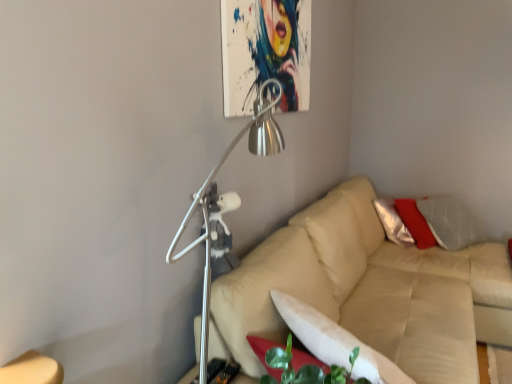
Question: Is metallic silver lamp at upper center positioned beyond the bounds of white soft pillow at lower center?

Choices:
 (A) yes
 (B) no

Answer: (A)

Question: Does metallic silver lamp at upper center have a smaller size compared to white soft pillow at lower center?

Choices:
 (A) yes
 (B) no

Answer: (B)

Question: Does metallic silver lamp at upper center appear on the right side of white soft pillow at lower center?

Choices:
 (A) yes
 (B) no

Answer: (B)

Question: From the image's perspective, is metallic silver lamp at upper center on top of white soft pillow at lower center?

Choices:
 (A) yes
 (B) no

Answer: (A)

Question: Is the position of metallic silver lamp at upper center more distant than that of white soft pillow at lower center?

Choices:
 (A) no
 (B) yes

Answer: (A)

Question: Do you think metallic silver lamp at upper center is within beige leather couch at center, or outside of it?

Choices:
 (A) outside
 (B) inside

Answer: (A)

Question: Relative to beige leather couch at center, is metallic silver lamp at upper center in front or behind?

Choices:
 (A) behind
 (B) front

Answer: (B)

Question: Is point (259, 142) closer or farther from the camera than point (394, 309)?

Choices:
 (A) closer
 (B) farther

Answer: (A)

Question: From their relative heights in the image, would you say metallic silver lamp at upper center is taller or shorter than beige leather couch at center?

Choices:
 (A) short
 (B) tall

Answer: (B)

Question: Relative to white soft pillow at lower center, is beige leather couch at center in front or behind?

Choices:
 (A) front
 (B) behind

Answer: (B)

Question: Considering the positions of point (426, 357) and point (376, 354), is point (426, 357) closer or farther from the camera than point (376, 354)?

Choices:
 (A) closer
 (B) farther

Answer: (B)

Question: Would you say beige leather couch at center is inside or outside white soft pillow at lower center?

Choices:
 (A) outside
 (B) inside

Answer: (A)

Question: From a real-world perspective, is beige leather couch at center physically located above or below white soft pillow at lower center?

Choices:
 (A) above
 (B) below

Answer: (B)

Question: From a real-world perspective, relative to white soft pillow at lower center, is metallic silver lamp at upper center vertically above or below?

Choices:
 (A) above
 (B) below

Answer: (A)

Question: From the image's perspective, is metallic silver lamp at upper center positioned above or below white soft pillow at lower center?

Choices:
 (A) below
 (B) above

Answer: (B)